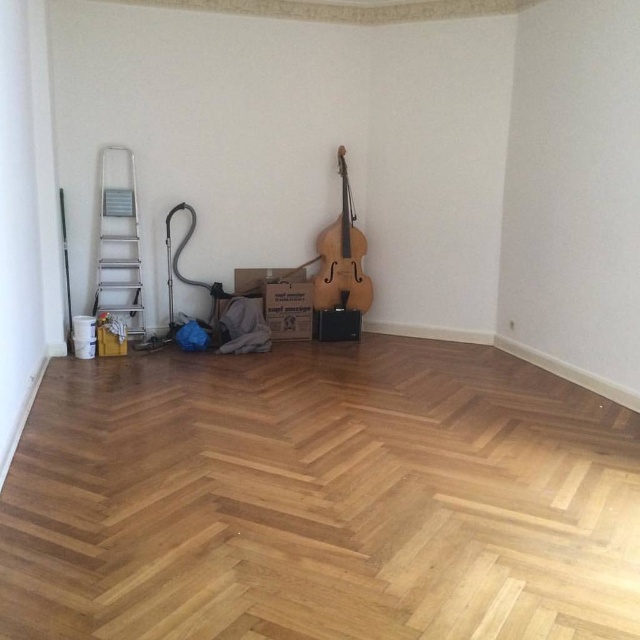
You are moving into a new apartment and need to place your wooden cello at center and brown cardboard box at lower left in the room. The room has limited space. Can you fit both items in the room without them touching each other?

The wooden cello at center is 6.43 feet away from the brown cardboard box at lower left. Since they are already separated by this distance, they are not touching each other, so both items can fit in the room without touching.

You are standing at the entrance of the room and want to place a new item exactly at the center of the room. Is the brown cardboard box at center currently occupying that spot?

The brown cardboard box at center is located at point [289,308], which is very close to the center of the room. Therefore, it is occupying the central spot.